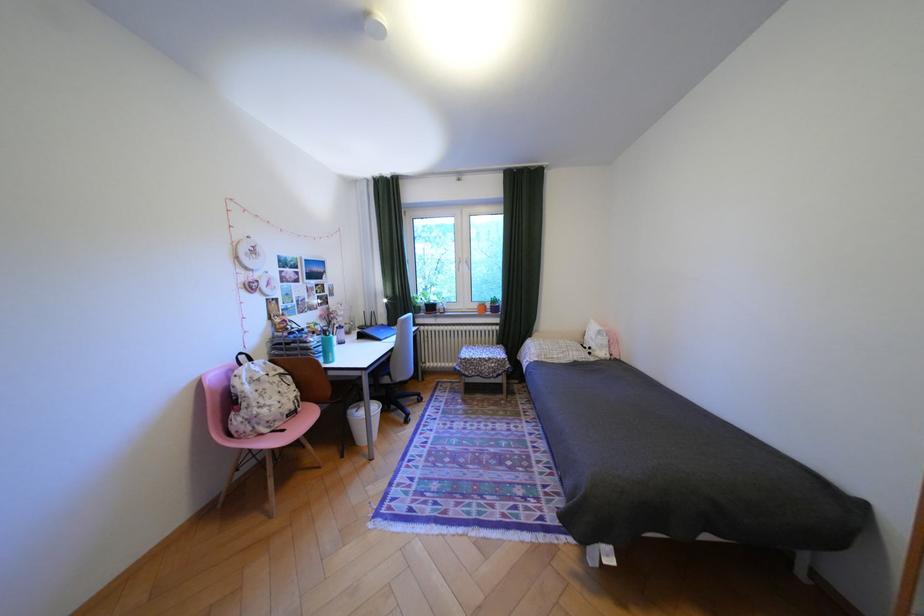
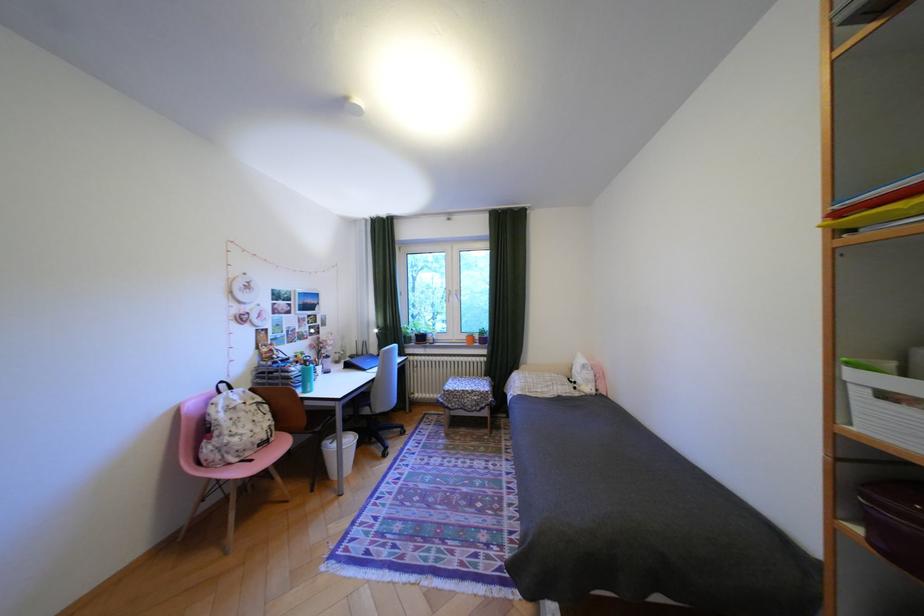
Question: The first image is from the beginning of the video and the second image is from the end. How did the camera likely rotate when shooting the video?

Choices:
 (A) Left
 (B) Right
 (C) Up
 (D) Down

Answer: (C)